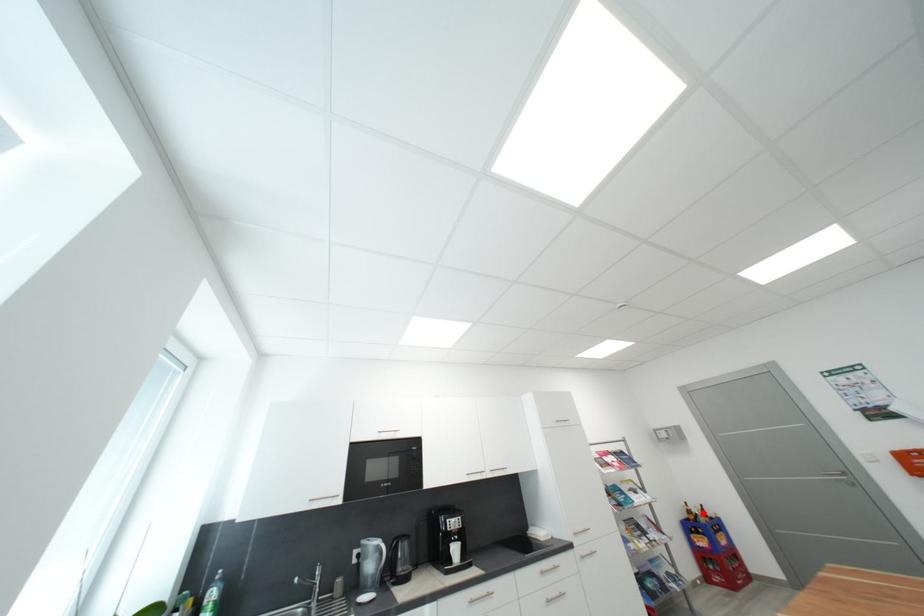
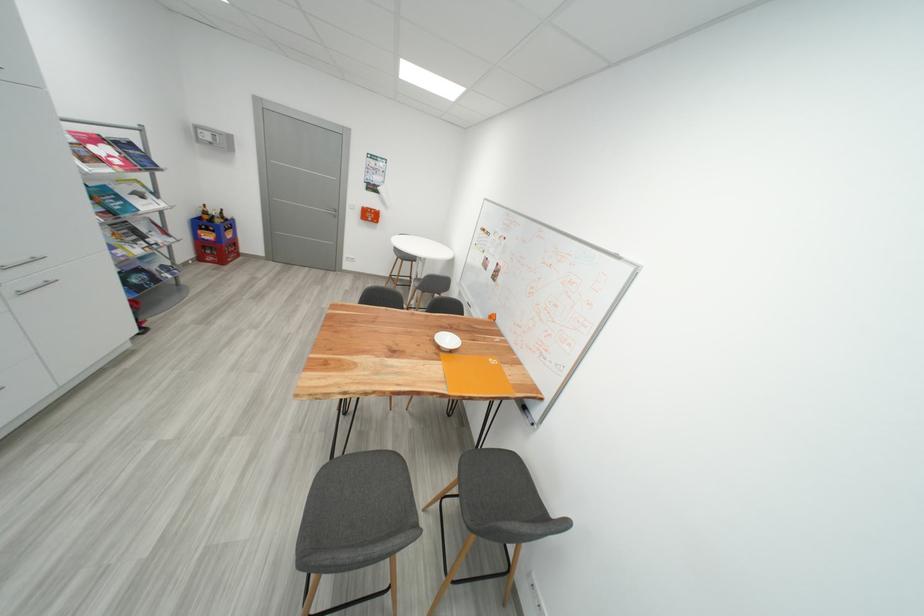
Find the pixel in the second image that matches the highlighted location in the first image.

(220, 214)